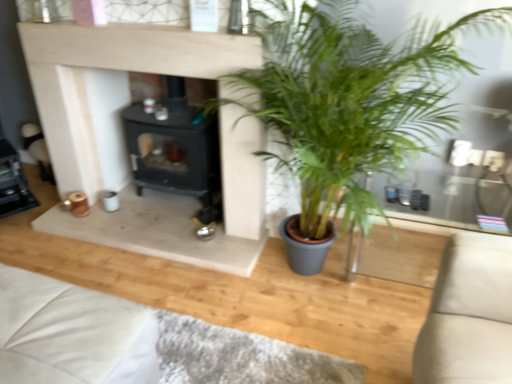
This screenshot has height=384, width=512. Find the location of `free region under green leafy plant at center (from a real-world perspective)`. free region under green leafy plant at center (from a real-world perspective) is located at coordinates (316, 289).